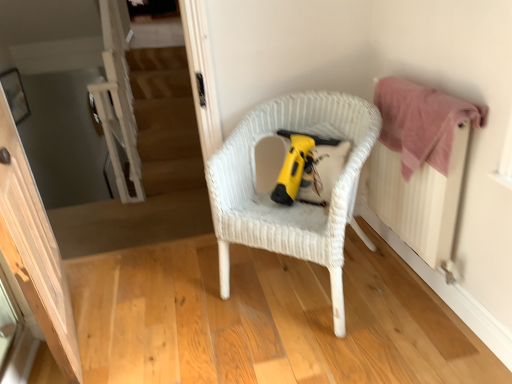
Question: Does yellow plastic vacuum cleaner at center have a smaller size compared to pink fabric radiator at right?

Choices:
 (A) yes
 (B) no

Answer: (A)

Question: Would you say yellow plastic vacuum cleaner at center contains pink fabric radiator at right?

Choices:
 (A) no
 (B) yes

Answer: (A)

Question: Is yellow plastic vacuum cleaner at center aimed at pink fabric radiator at right?

Choices:
 (A) no
 (B) yes

Answer: (A)

Question: Considering the relative positions of yellow plastic vacuum cleaner at center and pink fabric radiator at right in the image provided, is yellow plastic vacuum cleaner at center to the right of pink fabric radiator at right from the viewer's perspective?

Choices:
 (A) yes
 (B) no

Answer: (B)

Question: Is yellow plastic vacuum cleaner at center to the left of pink fabric radiator at right from the viewer's perspective?

Choices:
 (A) yes
 (B) no

Answer: (A)

Question: Is yellow plastic vacuum cleaner at center located outside pink fabric radiator at right?

Choices:
 (A) no
 (B) yes

Answer: (B)

Question: Can you confirm if yellow plastic vacuum cleaner at center is wider than white wicker chair at center?

Choices:
 (A) no
 (B) yes

Answer: (A)

Question: Is yellow plastic vacuum cleaner at center not within white wicker chair at center?

Choices:
 (A) yes
 (B) no

Answer: (B)

Question: Does yellow plastic vacuum cleaner at center appear on the right side of white wicker chair at center?

Choices:
 (A) yes
 (B) no

Answer: (A)

Question: From the image's perspective, does yellow plastic vacuum cleaner at center appear lower than white wicker chair at center?

Choices:
 (A) yes
 (B) no

Answer: (B)

Question: Is white wicker chair at center a part of yellow plastic vacuum cleaner at center?

Choices:
 (A) yes
 (B) no

Answer: (B)

Question: Does yellow plastic vacuum cleaner at center have a greater height compared to white wicker chair at center?

Choices:
 (A) no
 (B) yes

Answer: (A)

Question: Would you say wooden floor at center is a long distance from white wicker chair at center?

Choices:
 (A) no
 (B) yes

Answer: (A)